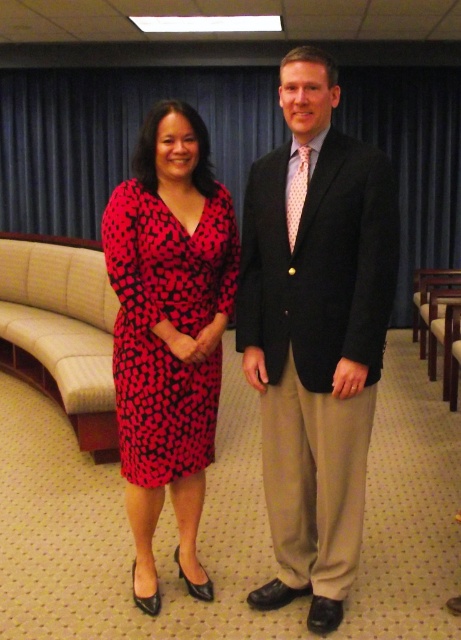
Question: Does matte black suit at center appear over red dotted fabric dress at center?

Choices:
 (A) no
 (B) yes

Answer: (A)

Question: Can you confirm if matte black suit at center is positioned above red dotted fabric dress at center?

Choices:
 (A) yes
 (B) no

Answer: (B)

Question: Which point is closer to the camera?

Choices:
 (A) (139, 342)
 (B) (344, 148)

Answer: (B)

Question: Does matte black suit at center have a smaller size compared to red dotted fabric dress at center?

Choices:
 (A) yes
 (B) no

Answer: (B)